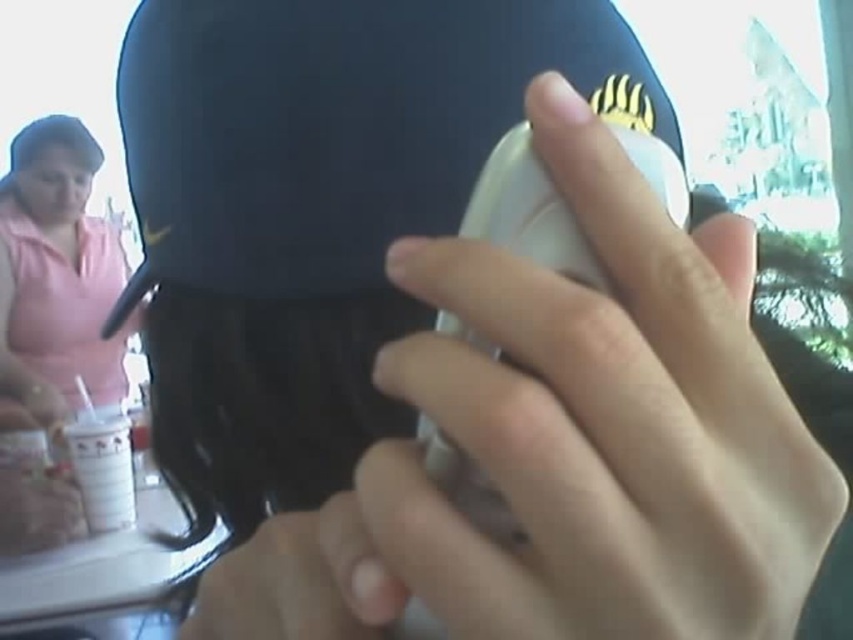
Question: Does matte black baseball cap at center have a smaller size compared to pink cotton shirt at upper left?

Choices:
 (A) yes
 (B) no

Answer: (A)

Question: Does white matte phone at center appear over white paper cup at lower left?

Choices:
 (A) yes
 (B) no

Answer: (A)

Question: Can you confirm if matte black baseball cap at center is wider than white paper cup at lower left?

Choices:
 (A) no
 (B) yes

Answer: (A)

Question: Among these objects, which one is nearest to the camera?

Choices:
 (A) matte black baseball cap at center
 (B) white matte phone at center
 (C) white paper cup at lower left

Answer: (B)

Question: Which object appears closest to the camera in this image?

Choices:
 (A) white matte phone at center
 (B) white paper cup at lower left

Answer: (A)

Question: Which is farther from the white matte phone at center?

Choices:
 (A) white paper cup at lower left
 (B) pink cotton shirt at upper left

Answer: (B)